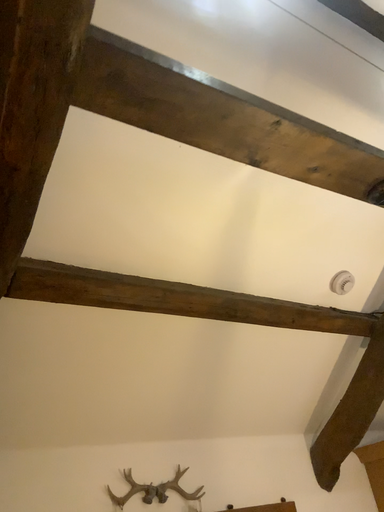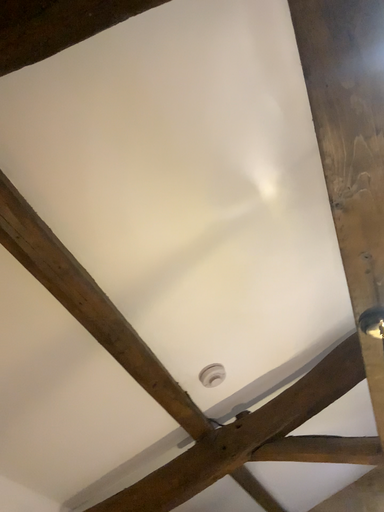
Question: Which way did the camera rotate in the video?

Choices:
 (A) rotated right
 (B) rotated left

Answer: (A)